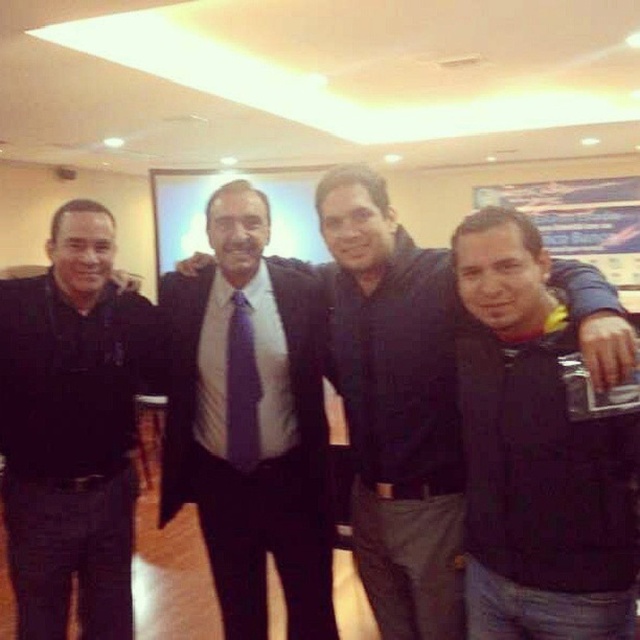
Question: Considering the real-world distances, which object is farthest from the black uniform at left?

Choices:
 (A) matte black suit at center
 (B) black fabric jacket at right

Answer: (B)

Question: Does black uniform at left appear on the left side of purple textured tie at center?

Choices:
 (A) no
 (B) yes

Answer: (B)

Question: Can you confirm if black fabric jacket at right is thinner than matte black suit at center?

Choices:
 (A) no
 (B) yes

Answer: (B)

Question: Which point is closer to the camera?

Choices:
 (A) black fabric jacket at right
 (B) purple textured tie at center

Answer: (A)

Question: Which object is closer to the camera taking this photo?

Choices:
 (A) purple textured tie at center
 (B) black fabric jacket at right

Answer: (B)

Question: Is black fabric jacket at right above matte black suit at center?

Choices:
 (A) yes
 (B) no

Answer: (B)